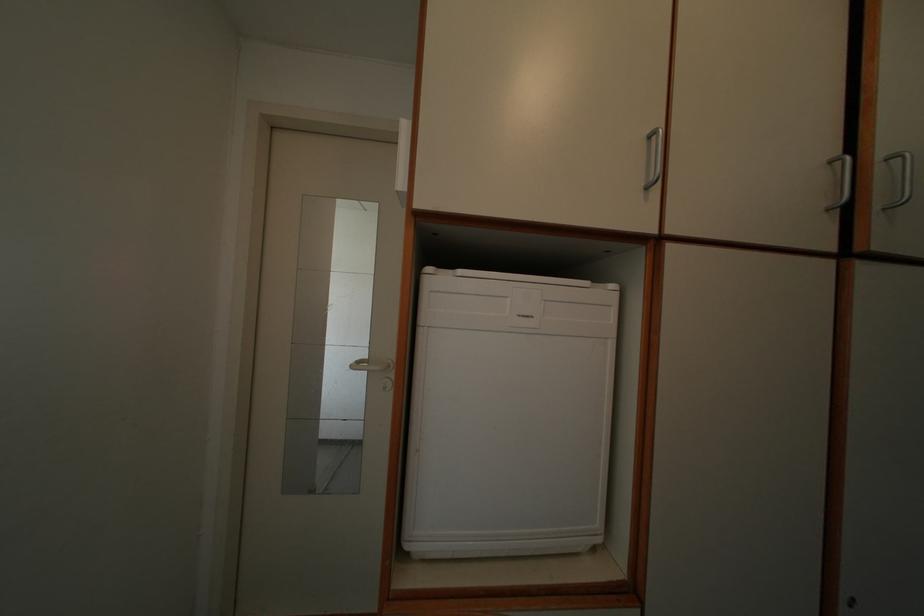
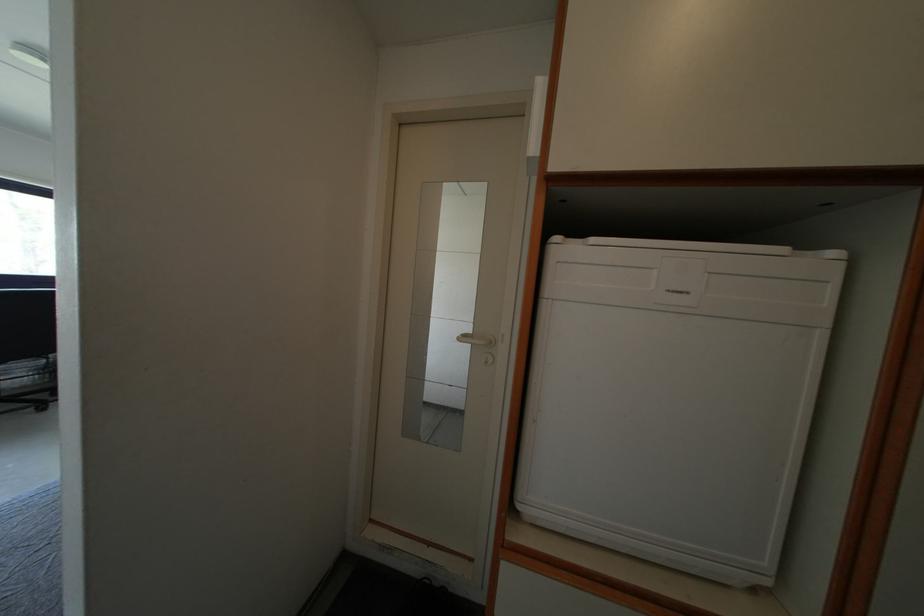
Where in the second image is the point corresponding to pixel 363 369 from the first image?

(468, 342)